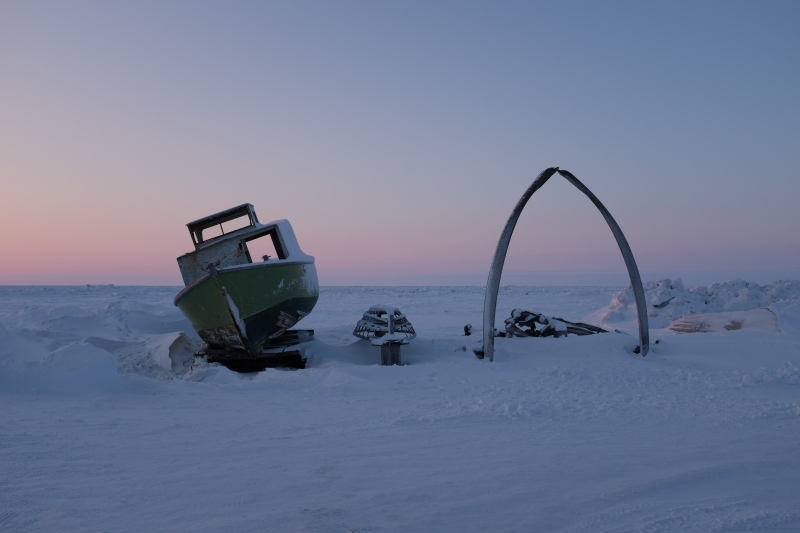
Locate an element on the screen. The height and width of the screenshot is (533, 800). galley is located at coordinates (218, 260).